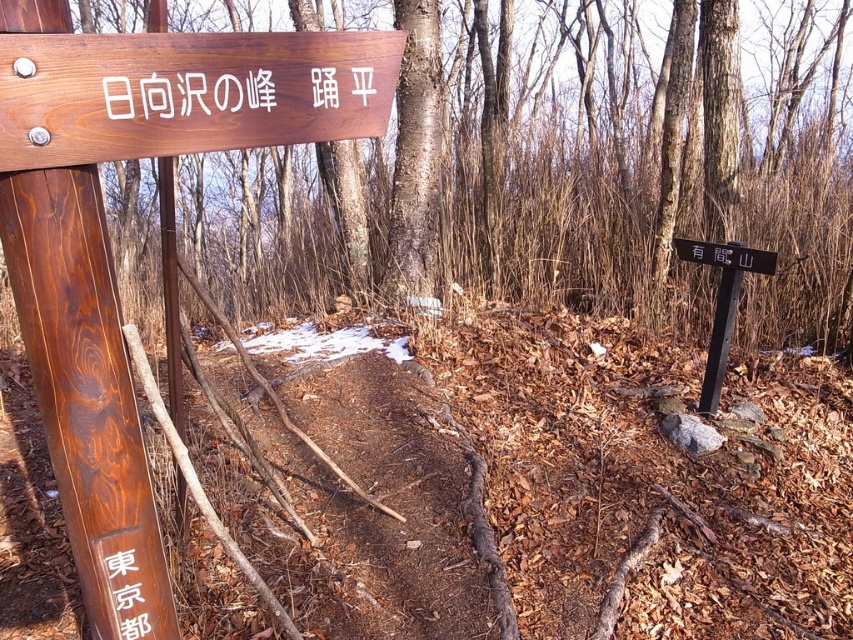
Question: Which object appears closest to the camera in this image?

Choices:
 (A) black wood sign at right
 (B) black metal signpost at right

Answer: (A)

Question: Observing the image, what is the correct spatial positioning of wooden sign at upper left in reference to black wood sign at right?

Choices:
 (A) right
 (B) left

Answer: (B)

Question: Is brown wooden signpost at upper left to the left of wooden sign at upper left from the viewer's perspective?

Choices:
 (A) no
 (B) yes

Answer: (B)

Question: Which of the following is the closest to the observer?

Choices:
 (A) (93, 273)
 (B) (316, 84)
 (C) (764, 259)
 (D) (706, 371)

Answer: (A)

Question: Where is wooden sign at upper left located in relation to white wood sign at upper left in the image?

Choices:
 (A) below
 (B) above

Answer: (A)

Question: Which is nearer to the wooden sign at upper left?

Choices:
 (A) white wood sign at upper left
 (B) brown wooden signpost at upper left
 (C) black wood sign at lower left

Answer: (A)